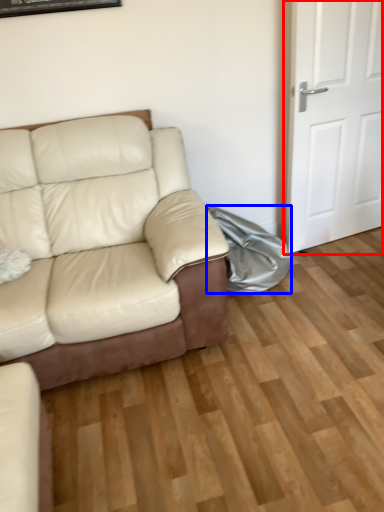
Question: Among these objects, which one is farthest to the camera, door (highlighted by a red box) or material (highlighted by a blue box)?

Choices:
 (A) door
 (B) material

Answer: (B)